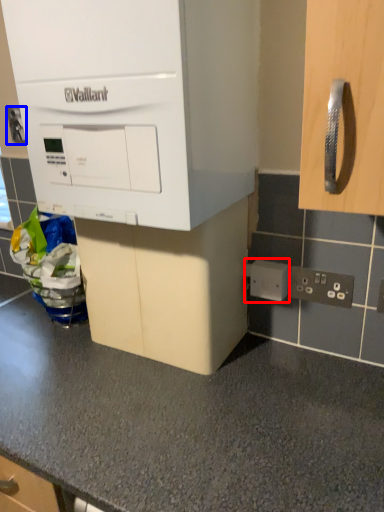
Question: Which point is closer to the camera, electric outlet (highlighted by a red box) or electric outlet (highlighted by a blue box)?

Choices:
 (A) electric outlet
 (B) electric outlet

Answer: (A)